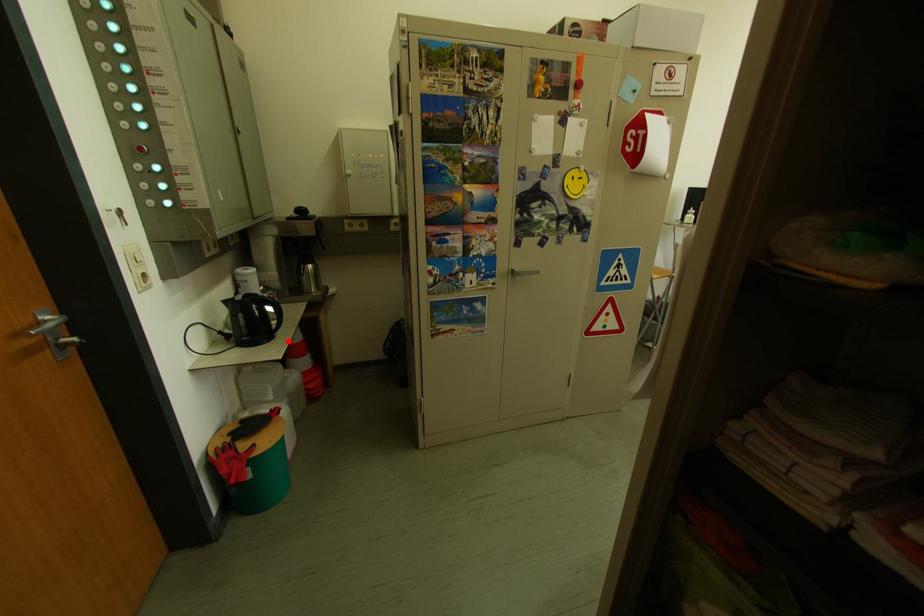
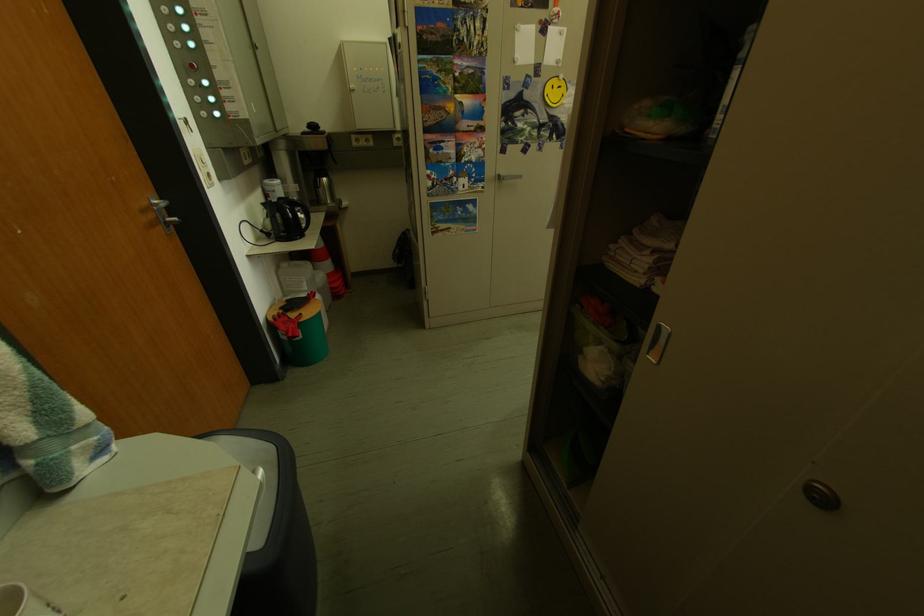
Question: I am providing you with two images of the same scene from different viewpoints. Image1 has a red point marked. In image2, the corresponding 3D location appears at what relative position? Reply with the corresponding letter.

Choices:
 (A) Closer
 (B) Farther

Answer: (A)